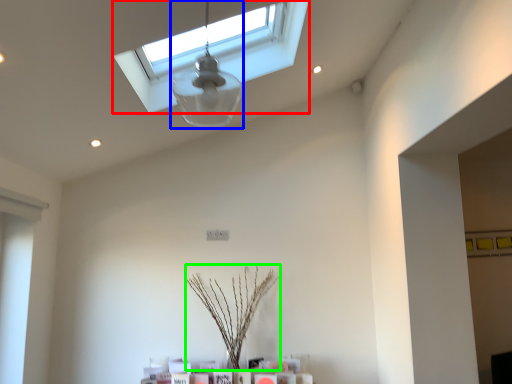
Question: Estimate the real-world distances between objects in this image. Which object is closer to window (highlighted by a red box), lamp (highlighted by a blue box) or plant (highlighted by a green box)?

Choices:
 (A) lamp
 (B) plant

Answer: (A)